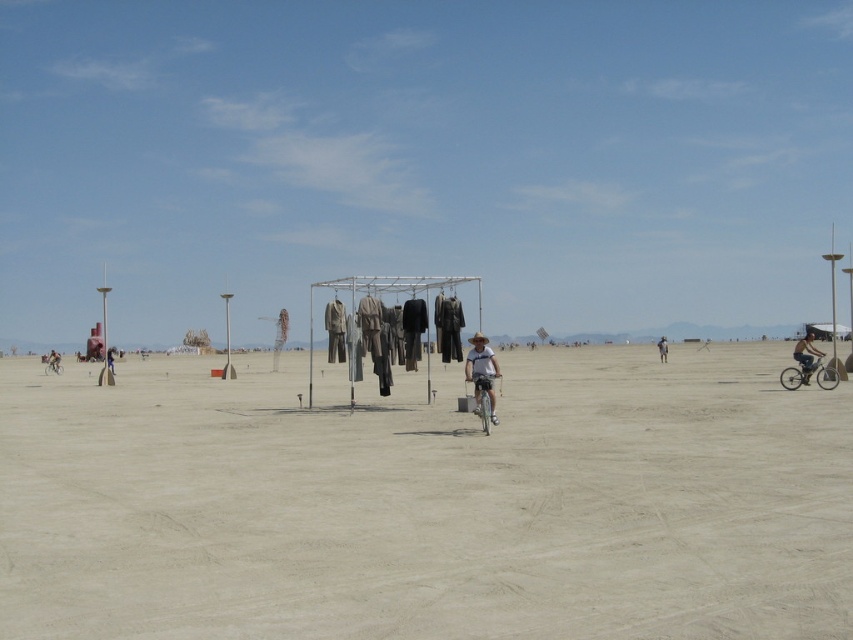
You are a photographer standing at the camera position. You want to place a 2 meter tall tripod between you and the sandy beige dirt at center. Is there enough space to set it up?

The distance between the sandy beige dirt at center and the camera is 6.04 meters. Since the tripod is 2 meters tall, there is sufficient space to set it up between the photographer and the sandy beige dirt at center.

You are a photographer planning to take a picture of the sandy beige dirt at center and the matte black bicycle at right. Based on their positions, which object will appear larger in the photo?

The matte black bicycle at right appears larger in the photo because it is closer to the camera than the sandy beige dirt at center, which is positioned under it.

You are a traveler in the desert who wants to reach the silver metallic bicycle at lower left. You are currently standing near the white cotton shirt at center. Which direction should you move to get to the bicycle?

The white cotton shirt at center is located above the silver metallic bicycle at lower left, so you should move downward or southward to reach the bicycle.